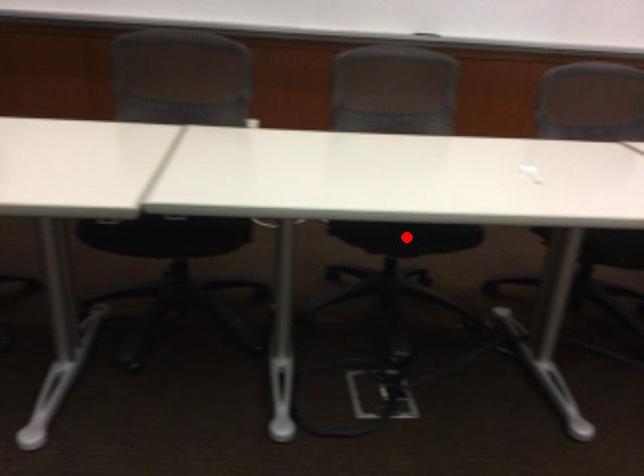
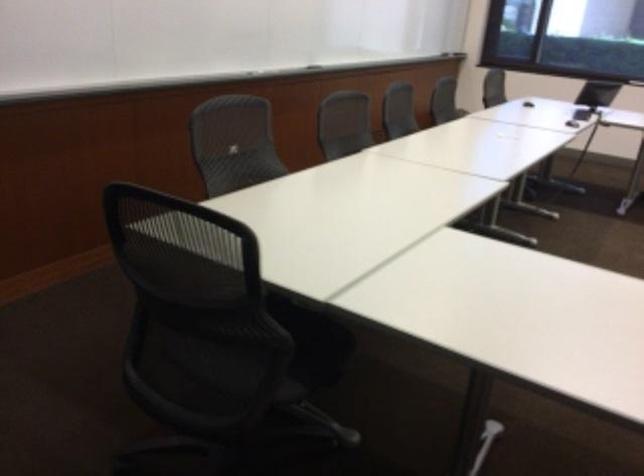
Question: I am providing you with two images of the same scene from different viewpoints. A red point is marked on the first image. Can you still see the location of the red point in image 2?

Choices:
 (A) Yes
 (B) No

Answer: (B)